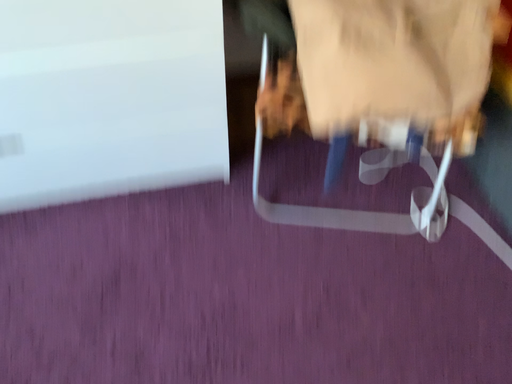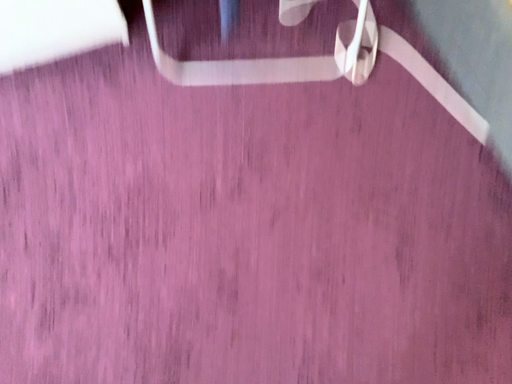
Question: How did the camera likely rotate when shooting the video?

Choices:
 (A) rotated downward
 (B) rotated upward

Answer: (A)